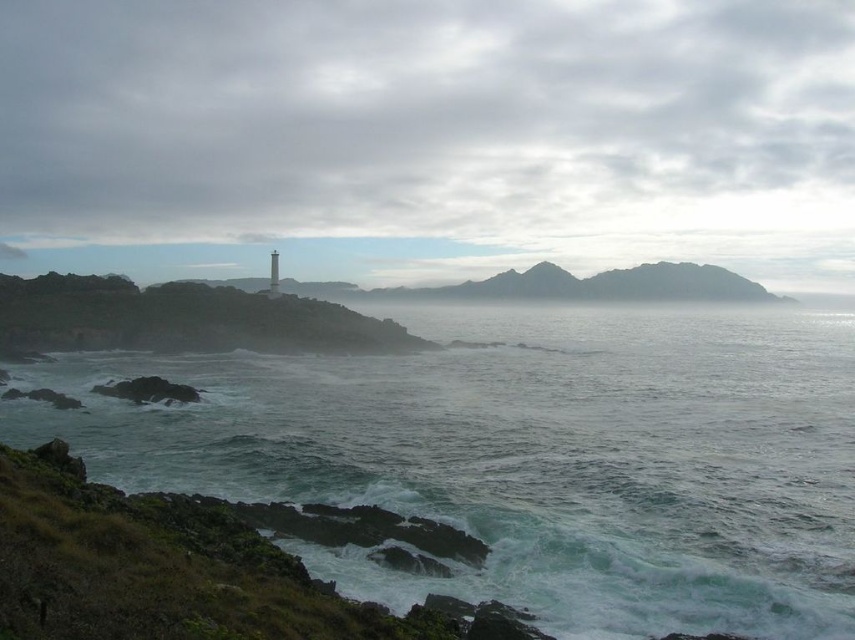
Question: Can you confirm if white frothy water at lower left is smaller than white concrete pillar at upper center?

Choices:
 (A) no
 (B) yes

Answer: (A)

Question: Does white frothy water at lower left appear under white concrete pillar at upper center?

Choices:
 (A) yes
 (B) no

Answer: (A)

Question: Which point is farther to the camera?

Choices:
 (A) (270, 259)
 (B) (329, 440)
 (C) (175, 339)

Answer: (A)

Question: Which point is closer to the camera?

Choices:
 (A) rugged stone cliff at center-left
 (B) white concrete pillar at upper center
 (C) white frothy water at lower left

Answer: (C)

Question: Does white frothy water at lower left appear on the right side of white concrete pillar at upper center?

Choices:
 (A) no
 (B) yes

Answer: (B)

Question: Which of the following is the closest to the observer?

Choices:
 (A) (162, 320)
 (B) (273, 260)

Answer: (A)